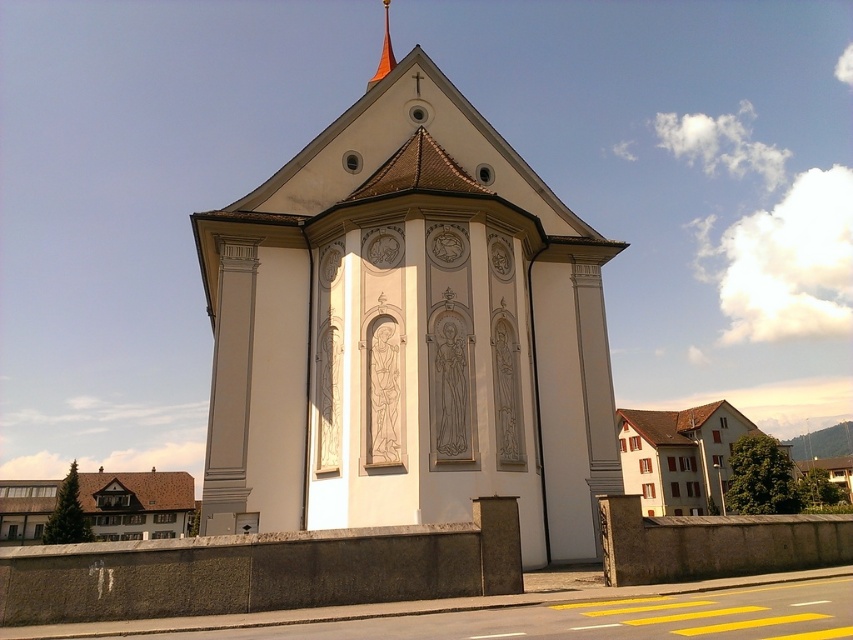
Is white stone chapel at center further to camera compared to orange glossy spire at upper center?

No, it is not.

This screenshot has height=640, width=853. What do you see at coordinates (407, 332) in the screenshot?
I see `white stone chapel at center` at bounding box center [407, 332].

At what (x,y) coordinates should I click in order to perform the action: click on white stone chapel at center. Please return your answer as a coordinate pair (x, y). Image resolution: width=853 pixels, height=640 pixels. Looking at the image, I should click on (407, 332).

Is brown shingles house at lower left to the left of orange glossy spire at upper center from the viewer's perspective?

Yes, brown shingles house at lower left is to the left of orange glossy spire at upper center.

Is point (103, 525) farther from viewer compared to point (386, 16)?

No, it is in front of (386, 16).

Locate an element on the screen. brown shingles house at lower left is located at coordinates (x=137, y=502).

Is white stone chapel at center taller than brown shingles house at lower left?

No, white stone chapel at center is not taller than brown shingles house at lower left.

Can you confirm if white stone chapel at center is bigger than brown shingles house at lower left?

No, white stone chapel at center is not bigger than brown shingles house at lower left.

The height and width of the screenshot is (640, 853). In order to click on white stone chapel at center in this screenshot , I will do `click(407, 332)`.